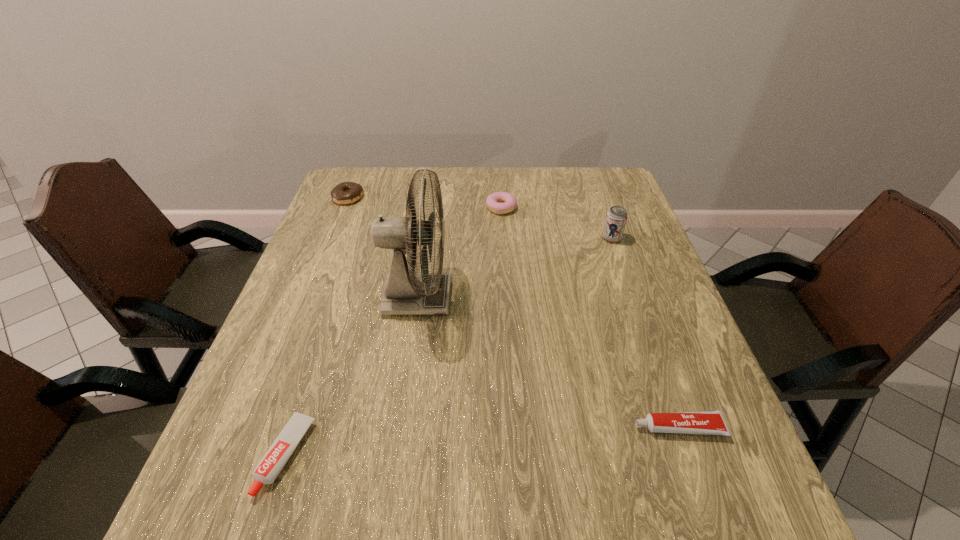
The width and height of the screenshot is (960, 540). Find the location of `the fourth object from right to left`. the fourth object from right to left is located at coordinates 406,292.

You are a GUI agent. You are given a task and a screenshot of the screen. Output one action in this format:
    pyautogui.click(x=<x>, y=<y>)
    Task: Click on the tallest object
    The width and height of the screenshot is (960, 540).
    Given the screenshot: What is the action you would take?
    coord(406,292)

What are the coordinates of `the second tallest object` in the screenshot? It's located at (616, 218).

The height and width of the screenshot is (540, 960). In order to click on the third farthest object in this screenshot , I will do `click(616, 218)`.

You are a GUI agent. You are given a task and a screenshot of the screen. Output one action in this format:
    pyautogui.click(x=<x>, y=<y>)
    Task: Click on the left doughnut
    Image resolution: width=960 pixels, height=540 pixels.
    Given the screenshot: What is the action you would take?
    (x=346, y=192)

You are a GUI agent. You are given a task and a screenshot of the screen. Output one action in this format:
    pyautogui.click(x=<x>, y=<y>)
    Task: Click on the right doughnut
    The image size is (960, 540).
    Given the screenshot: What is the action you would take?
    pyautogui.click(x=500, y=202)

The height and width of the screenshot is (540, 960). Find the location of `the right toothpaste`. the right toothpaste is located at coordinates (703, 422).

You are a GUI agent. You are given a task and a screenshot of the screen. Output one action in this format:
    pyautogui.click(x=<x>, y=<y>)
    Task: Click on the left toothpaste
    
    Given the screenshot: What is the action you would take?
    pyautogui.click(x=278, y=454)

The width and height of the screenshot is (960, 540). Find the location of `vacant space located 0.160m on the front-facing side of the third object from left to right`. vacant space located 0.160m on the front-facing side of the third object from left to right is located at coordinates (518, 298).

At what (x,y) coordinates should I click in order to perform the action: click on free location located on the left of the beer can. Please return your answer as a coordinate pair (x, y). The width and height of the screenshot is (960, 540). Looking at the image, I should click on (517, 238).